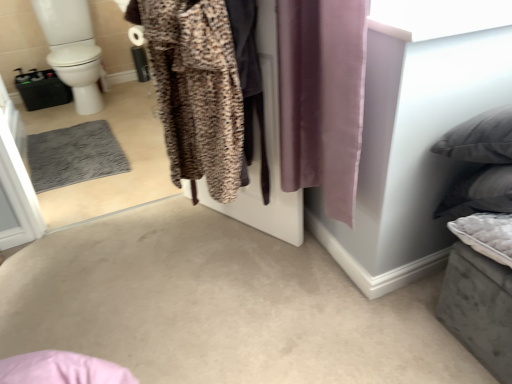
Question: Should I look upward or downward to see purple silky curtain at center?

Choices:
 (A) up
 (B) down

Answer: (A)

Question: Does leopard print fabric at center have a greater height compared to brown textured robe at center?

Choices:
 (A) no
 (B) yes

Answer: (B)

Question: Does leopard print fabric at center turn towards brown textured robe at center?

Choices:
 (A) no
 (B) yes

Answer: (B)

Question: Is brown textured robe at center completely or partially inside leopard print fabric at center?

Choices:
 (A) no
 (B) yes

Answer: (A)

Question: From the image's perspective, is leopard print fabric at center beneath brown textured robe at center?

Choices:
 (A) yes
 (B) no

Answer: (A)

Question: Can you confirm if leopard print fabric at center is smaller than brown textured robe at center?

Choices:
 (A) yes
 (B) no

Answer: (A)

Question: Is leopard print fabric at center not inside brown textured robe at center?

Choices:
 (A) yes
 (B) no

Answer: (B)

Question: From a real-world perspective, is brown textured robe at center below leopard print fabric at center?

Choices:
 (A) no
 (B) yes

Answer: (A)

Question: Can you confirm if brown textured robe at center is smaller than leopard print fabric at center?

Choices:
 (A) yes
 (B) no

Answer: (B)

Question: Would you say brown textured robe at center is outside leopard print fabric at center?

Choices:
 (A) no
 (B) yes

Answer: (B)

Question: Is leopard print fabric at center at the back of brown textured robe at center?

Choices:
 (A) no
 (B) yes

Answer: (B)

Question: From a real-world perspective, does brown textured robe at center stand above leopard print fabric at center?

Choices:
 (A) no
 (B) yes

Answer: (B)

Question: Is brown textured robe at center closer to the viewer compared to leopard print fabric at center?

Choices:
 (A) yes
 (B) no

Answer: (A)

Question: Is leopard print fabric at center facing away from white glossy toilet bowl at left?

Choices:
 (A) no
 (B) yes

Answer: (A)